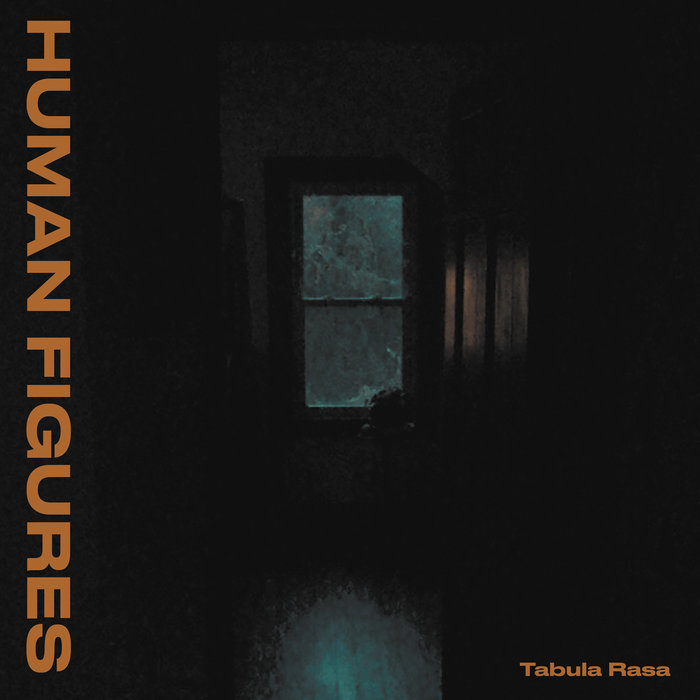
The image size is (700, 700). In order to click on wooden door in this screenshot , I will do `click(484, 323)`.